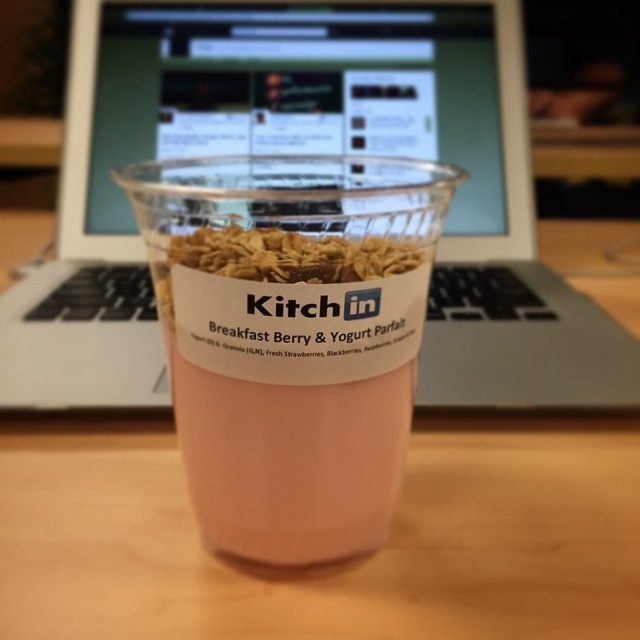
Question: In this image, where is sleek silver laptop at center located relative to wooden table at center?

Choices:
 (A) above
 (B) below

Answer: (A)

Question: Does wooden table at center have a greater width compared to pink translucent cup at center?

Choices:
 (A) no
 (B) yes

Answer: (B)

Question: Which object is closer to the camera taking this photo?

Choices:
 (A) sleek silver laptop at center
 (B) pink translucent cup at center

Answer: (B)

Question: Is wooden table at center bigger than pink translucent cup at center?

Choices:
 (A) yes
 (B) no

Answer: (A)

Question: Which point is farther to the camera?

Choices:
 (A) (371, 516)
 (B) (616, 378)
 (C) (586, 452)

Answer: (B)

Question: Which object appears farthest from the camera in this image?

Choices:
 (A) wooden table at center
 (B) pink translucent cup at center

Answer: (A)